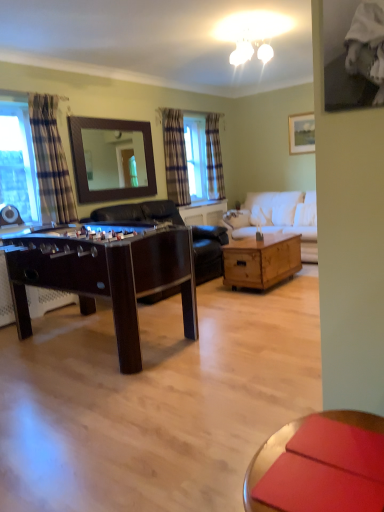
At what (x,y) coordinates should I click in order to perform the action: click on vacant area that is in front of dark wood foosball table at center, the first table when ordered from front to back. Please return your answer as a coordinate pair (x, y). The height and width of the screenshot is (512, 384). Looking at the image, I should click on (120, 422).